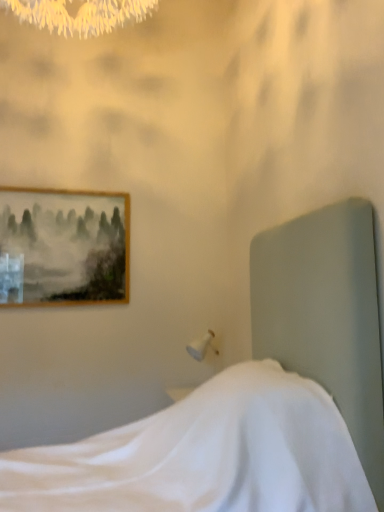
Question: Do you think wooden framed painting at upper left is within white fabric bed at center, or outside of it?

Choices:
 (A) inside
 (B) outside

Answer: (B)

Question: Is point (66, 274) closer or farther from the camera than point (119, 435)?

Choices:
 (A) farther
 (B) closer

Answer: (A)

Question: In terms of height, does wooden framed painting at upper left look taller or shorter compared to white fabric bed at center?

Choices:
 (A) short
 (B) tall

Answer: (A)

Question: Is white fabric bed at center bigger or smaller than wooden framed painting at upper left?

Choices:
 (A) small
 (B) big

Answer: (B)

Question: From the image's perspective, is white fabric bed at center positioned above or below wooden framed painting at upper left?

Choices:
 (A) above
 (B) below

Answer: (B)

Question: From their relative heights in the image, would you say white fabric bed at center is taller or shorter than wooden framed painting at upper left?

Choices:
 (A) short
 (B) tall

Answer: (B)

Question: Relative to wooden framed painting at upper left, is white fabric bed at center in front or behind?

Choices:
 (A) behind
 (B) front

Answer: (B)